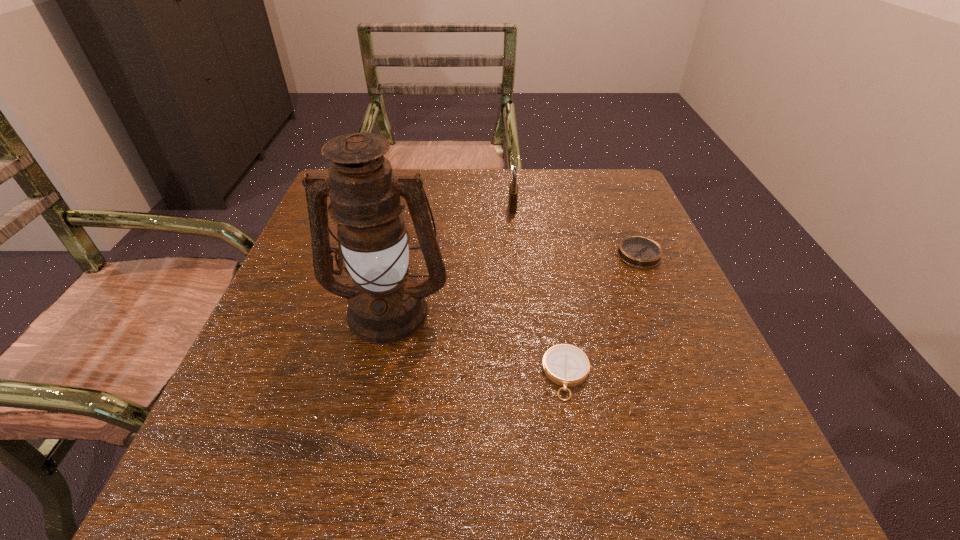
Identify the location of free space located on the left of the rightmost object. This screenshot has width=960, height=540. (576, 254).

Image resolution: width=960 pixels, height=540 pixels. I want to click on blank space located on the right of the nearest object, so click(675, 374).

Identify the location of object present at the far edge. (513, 189).

You are a GUI agent. You are given a task and a screenshot of the screen. Output one action in this format:
    pyautogui.click(x=<x>, y=<y>)
    Task: Click on the object located in the left edge section of the desktop
    The height and width of the screenshot is (540, 960).
    Given the screenshot: What is the action you would take?
    pyautogui.click(x=386, y=305)

Locate an element on the screen. This screenshot has width=960, height=540. object located at the right edge is located at coordinates (638, 251).

Locate an element on the screen. vacant space at the far edge is located at coordinates (508, 194).

What are the coordinates of `vacant space at the left edge of the desktop` in the screenshot? It's located at (267, 380).

Image resolution: width=960 pixels, height=540 pixels. What are the coordinates of `free space at the right edge` in the screenshot? It's located at (702, 377).

I want to click on vacant space at the far right corner of the desktop, so click(616, 204).

The height and width of the screenshot is (540, 960). Find the location of `vacant space at the near right corner of the desktop`. vacant space at the near right corner of the desktop is located at coordinates (679, 507).